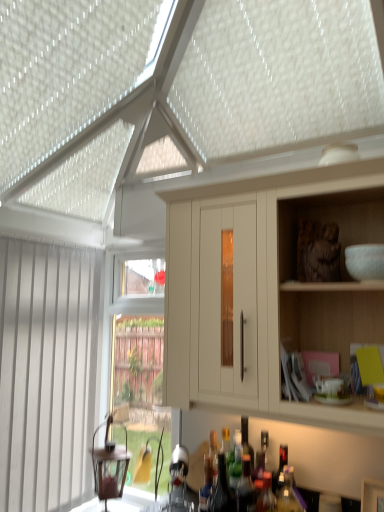
Question: From the image's perspective, is translucent glass bottle at lower center, acting as the 4th bottle starting from the left, above or below white vertical blinds at left?

Choices:
 (A) above
 (B) below

Answer: (B)

Question: Does point (268, 502) appear closer or farther from the camera than point (18, 376)?

Choices:
 (A) farther
 (B) closer

Answer: (B)

Question: Which object is positioned farthest from the white vertical blinds at left?

Choices:
 (A) translucent glass bottle at center, marked as the 4th bottle in a right-to-left arrangement
 (B) translucent glass bottle at lower center, acting as the 4th bottle starting from the left
 (C) matte white cabinet at upper right
 (D) translucent glass bottle at lower center, acting as the first bottle starting from the left
 (E) translucent glass bottle at center, which is counted as the 1th bottle, starting from the right

Answer: (B)

Question: Which is nearer to the matte white cabinet at upper right?

Choices:
 (A) white vertical blinds at left
 (B) translucent glass bottle at center, positioned as the second bottle in left-to-right order
 (C) translucent glass bottle at lower center, acting as the first bottle starting from the left
 (D) translucent glass bottle at lower center, positioned as the second bottle in right-to-left order
 (E) translucent glass bottle at center, acting as the 5th bottle starting from the left

Answer: (E)